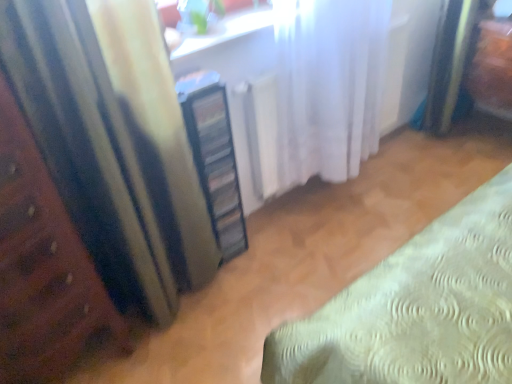
What do you see at coordinates (214, 157) in the screenshot? I see `clear plastic cabinet at center` at bounding box center [214, 157].

This screenshot has height=384, width=512. I want to click on matte yellow curtain at left, the 1th curtain from the left, so click(x=114, y=143).

Describe the element at coordinates (325, 89) in the screenshot. I see `white sheer curtain at center, positioned as the 1th curtain in right-to-left order` at that location.

Locate an element on the screen. white glossy window sill at upper center is located at coordinates (226, 31).

The image size is (512, 384). Describe the element at coordinates (226, 31) in the screenshot. I see `white glossy window sill at upper center` at that location.

I want to click on wooden bed frame at left, so click(44, 270).

Where is `clear plastic cabinet at center`? The height and width of the screenshot is (384, 512). clear plastic cabinet at center is located at coordinates (214, 157).

Does white glossy window sill at upper center lie behind matte yellow curtain at left, the 1th curtain from the left?

Yes, it is.

Between white glossy window sill at upper center and matte yellow curtain at left, the 1th curtain from the left, which one has smaller size?

white glossy window sill at upper center is smaller.

How different are the orientations of white glossy window sill at upper center and matte yellow curtain at left, the second curtain viewed from the right, in degrees?

The angle between the facing direction of white glossy window sill at upper center and the facing direction of matte yellow curtain at left, the second curtain viewed from the right, is 1.96 degrees.

Which object is positioned more to the right, white glossy window sill at upper center or matte yellow curtain at left, the second curtain viewed from the right?

Positioned to the right is white glossy window sill at upper center.

Which object is closer to the camera, clear plastic cabinet at center or white glossy window sill at upper center?

Positioned in front is clear plastic cabinet at center.

Visually, is clear plastic cabinet at center positioned to the left or to the right of white glossy window sill at upper center?

Clearly, clear plastic cabinet at center is on the left of white glossy window sill at upper center in the image.

Is clear plastic cabinet at center next to white glossy window sill at upper center?

No.

The image size is (512, 384). Find the location of `cabinetry that is below the white glossy window sill at upper center (from the image's perspective)`. cabinetry that is below the white glossy window sill at upper center (from the image's perspective) is located at coordinates (214, 157).

Is matte yellow curtain at left, the second curtain viewed from the right, in contact with white glossy window sill at upper center?

No, matte yellow curtain at left, the second curtain viewed from the right, is not beside white glossy window sill at upper center.

Is matte yellow curtain at left, the 1th curtain from the left, taller or shorter than white glossy window sill at upper center?

Considering their sizes, matte yellow curtain at left, the 1th curtain from the left, has more height than white glossy window sill at upper center.

From a real-world perspective, who is located lower, matte yellow curtain at left, the 1th curtain from the left, or white glossy window sill at upper center?

matte yellow curtain at left, the 1th curtain from the left, is physically lower.

Which of these two, matte yellow curtain at left, the second curtain viewed from the right, or white glossy window sill at upper center, is wider?

matte yellow curtain at left, the second curtain viewed from the right.

Is wooden bed frame at left not close to white sheer curtain at center, the second curtain from the left?

wooden bed frame at left is far away from white sheer curtain at center, the second curtain from the left.

Choose the correct answer: Is wooden bed frame at left inside white sheer curtain at center, the second curtain from the left, or outside it?

wooden bed frame at left exists outside the volume of white sheer curtain at center, the second curtain from the left.

In the scene shown: From a real-world perspective, which object stands above the other?

white sheer curtain at center, positioned as the 1th curtain in right-to-left order.

From the picture: Between wooden bed frame at left and white sheer curtain at center, positioned as the 1th curtain in right-to-left order, which one has smaller width?

With smaller width is white sheer curtain at center, positioned as the 1th curtain in right-to-left order.

Measure the distance from white sheer curtain at center, the second curtain from the left, to clear plastic cabinet at center.

15.97 inches.

Is point (276, 11) less distant than point (194, 148)?

That is False.

Is white sheer curtain at center, the second curtain from the left, inside or outside of clear plastic cabinet at center?

white sheer curtain at center, the second curtain from the left, lies outside clear plastic cabinet at center.

Is white sheer curtain at center, positioned as the 1th curtain in right-to-left order, positioned in front of clear plastic cabinet at center?

Yes, it is.

Can you tell me how much white sheer curtain at center, the second curtain from the left, and wooden bed frame at left differ in facing direction?

white sheer curtain at center, the second curtain from the left, and wooden bed frame at left are facing 0.576 degrees away from each other.

From the image's perspective, is white sheer curtain at center, the second curtain from the left, located beneath wooden bed frame at left?

Actually, white sheer curtain at center, the second curtain from the left, appears above wooden bed frame at left in the image.

Are white sheer curtain at center, positioned as the 1th curtain in right-to-left order, and wooden bed frame at left making contact?

white sheer curtain at center, positioned as the 1th curtain in right-to-left order, is not next to wooden bed frame at left, and they're not touching.

Who is smaller, white sheer curtain at center, the second curtain from the left, or wooden bed frame at left?

Smaller between the two is wooden bed frame at left.

Where is `cabinetry lying behind the wooden bed frame at left`? The image size is (512, 384). cabinetry lying behind the wooden bed frame at left is located at coordinates (214, 157).

From a real-world perspective, which is physically above, wooden bed frame at left or clear plastic cabinet at center?

wooden bed frame at left, from a real-world perspective.

Is wooden bed frame at left not near clear plastic cabinet at center?

That's not correct — wooden bed frame at left is a little close to clear plastic cabinet at center.

Is wooden bed frame at left completely or partially outside of clear plastic cabinet at center?

That's correct, wooden bed frame at left is outside of clear plastic cabinet at center.

Image resolution: width=512 pixels, height=384 pixels. What are the coordinates of `the 1st curtain located beneath the white glossy window sill at upper center (from a real-world perspective)` in the screenshot? It's located at (114, 143).

The image size is (512, 384). Find the location of `cabinetry on the left of the white glossy window sill at upper center`. cabinetry on the left of the white glossy window sill at upper center is located at coordinates (214, 157).

Estimate the real-world distances between objects in this image. Which object is closer to wooden bed frame at left, white sheer curtain at center, the second curtain from the left, or clear plastic cabinet at center?

clear plastic cabinet at center is positioned closer to the anchor wooden bed frame at left.

When comparing their distances from wooden bed frame at left, does matte yellow curtain at left, the 1th curtain from the left, or white sheer curtain at center, the second curtain from the left, seem further?

white sheer curtain at center, the second curtain from the left, is further to wooden bed frame at left.

When comparing their distances from white sheer curtain at center, the second curtain from the left, does matte yellow curtain at left, the 1th curtain from the left, or white glossy window sill at upper center seem closer?

white glossy window sill at upper center is closer to white sheer curtain at center, the second curtain from the left.

Considering their positions, is clear plastic cabinet at center positioned closer to wooden bed frame at left than white glossy window sill at upper center?

Among the two, clear plastic cabinet at center is located nearer to wooden bed frame at left.

Considering their positions, is matte yellow curtain at left, the 1th curtain from the left, positioned further to white sheer curtain at center, positioned as the 1th curtain in right-to-left order, than wooden bed frame at left?

wooden bed frame at left is further to white sheer curtain at center, positioned as the 1th curtain in right-to-left order.

Estimate the real-world distances between objects in this image. Which object is closer to wooden bed frame at left, clear plastic cabinet at center or white sheer curtain at center, the second curtain from the left?

clear plastic cabinet at center lies closer to wooden bed frame at left than the other object.

Based on their spatial positions, is white glossy window sill at upper center or wooden bed frame at left closer to clear plastic cabinet at center?

The object closer to clear plastic cabinet at center is white glossy window sill at upper center.

Looking at the image, which one is located closer to white glossy window sill at upper center, wooden bed frame at left or white sheer curtain at center, positioned as the 1th curtain in right-to-left order?

white sheer curtain at center, positioned as the 1th curtain in right-to-left order, lies closer to white glossy window sill at upper center than the other object.

Locate an element on the screen. The width and height of the screenshot is (512, 384). curtain between wooden bed frame at left and white sheer curtain at center, positioned as the 1th curtain in right-to-left order is located at coordinates (114, 143).

This screenshot has width=512, height=384. I want to click on cabinetry between matte yellow curtain at left, the second curtain viewed from the right, and white sheer curtain at center, the second curtain from the left, from left to right, so click(x=214, y=157).

Identify the location of cabinetry located between wooden bed frame at left and white sheer curtain at center, positioned as the 1th curtain in right-to-left order, in the left-right direction. The height and width of the screenshot is (384, 512). (214, 157).

Locate an element on the screen. The width and height of the screenshot is (512, 384). cabinetry between white glossy window sill at upper center and matte yellow curtain at left, the 1th curtain from the left, in the up-down direction is located at coordinates (214, 157).